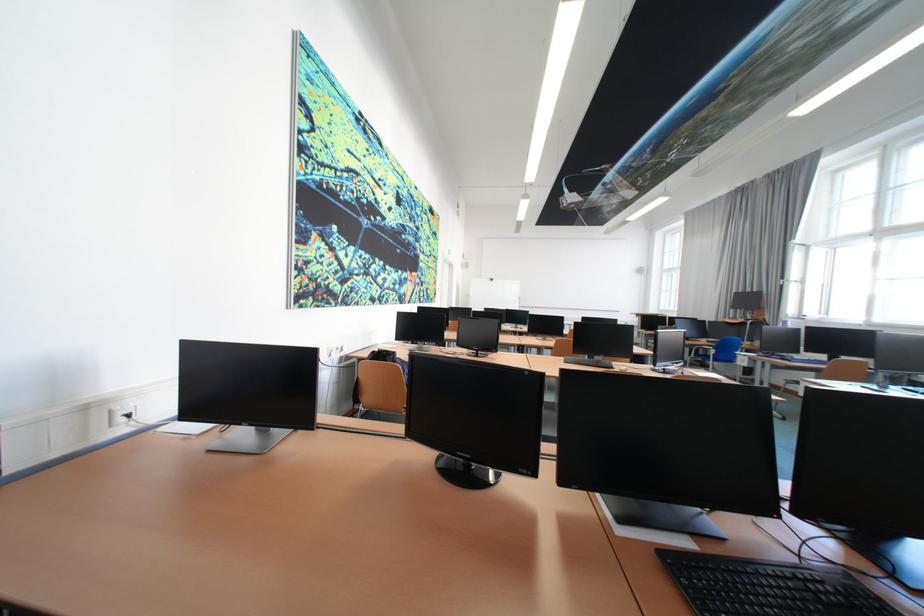
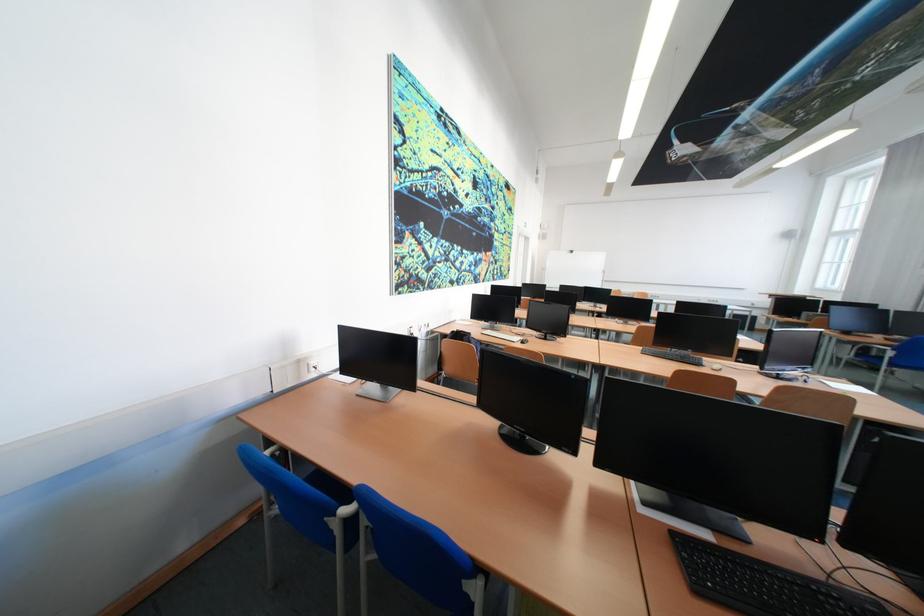
Question: Based on the continuous images, in which direction is the camera rotating? Reply with the corresponding letter.

Choices:
 (A) Left
 (B) Right
 (C) Up
 (D) Down

Answer: (A)